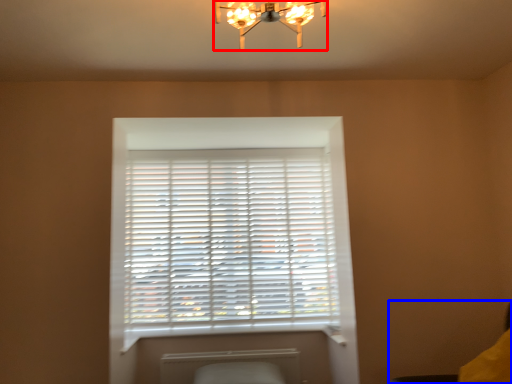
Question: Which object is further to the camera taking this photo, lamp (highlighted by a red box) or swivel chair (highlighted by a blue box)?

Choices:
 (A) lamp
 (B) swivel chair

Answer: (B)